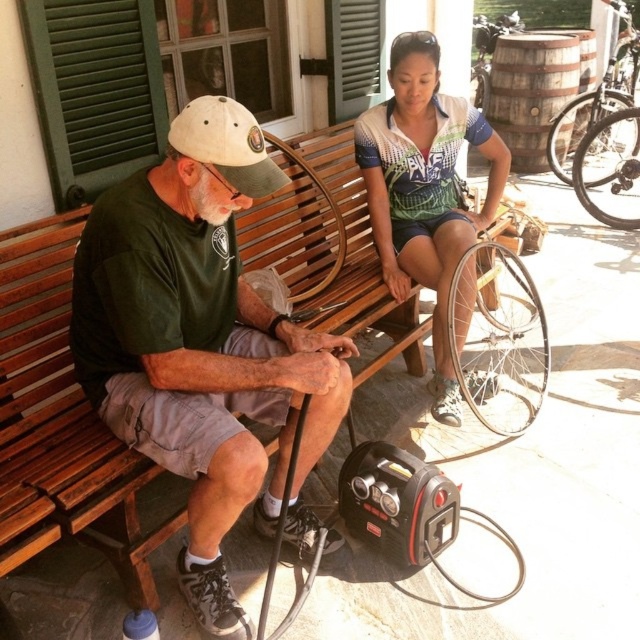
You are a photographer trying to capture a candid shot of both the white jersey at upper center and the silver metallic bicycle wheel at right. Based on their positions, can you tell me which object is closer to the camera?

The white jersey at upper center is located below the silver metallic bicycle wheel at right, which means the silver metallic bicycle wheel at right is closer to the camera.

You are a delivery person trying to place a package between the green fabric shirt at left and the white jersey at upper center. The package is 1.2 meters long. Will it fit in the space between them?

The distance between the green fabric shirt at left and the white jersey at upper center is 1.17 meters. Since the package is 1.2 meters long, it will not fit in the space between them as it is slightly longer than the available distance.